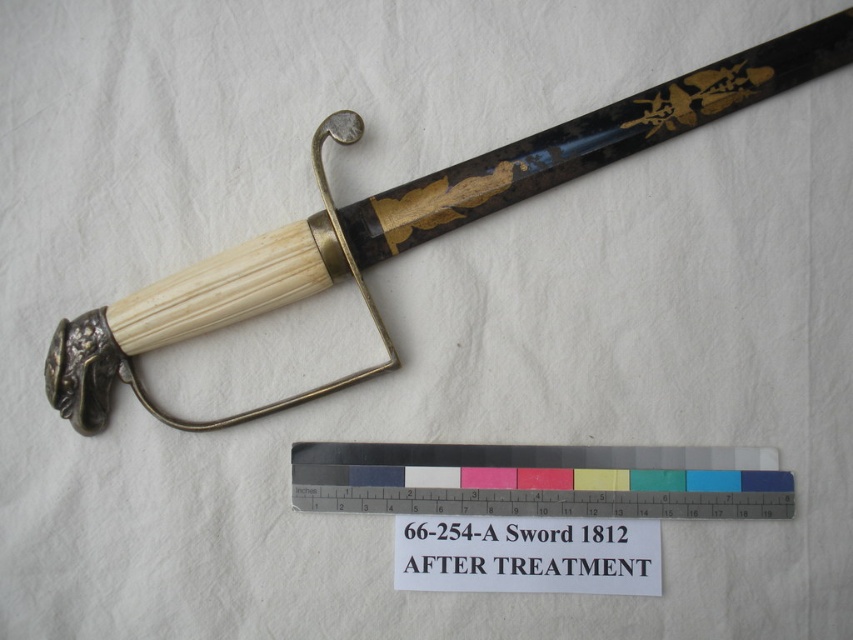
Question: Does matte black sword at upper center appear over metallic ruler at center?

Choices:
 (A) no
 (B) yes

Answer: (B)

Question: Which object appears closest to the camera in this image?

Choices:
 (A) black paper sign at lower center
 (B) matte black sword at upper center

Answer: (B)

Question: Does metallic ruler at center appear over black paper sign at lower center?

Choices:
 (A) yes
 (B) no

Answer: (A)

Question: Which object is positioned closest to the black paper sign at lower center?

Choices:
 (A) matte black sword at upper center
 (B) metallic ruler at center

Answer: (B)

Question: Among these objects, which one is nearest to the camera?

Choices:
 (A) black paper sign at lower center
 (B) matte black sword at upper center
 (C) metallic ruler at center

Answer: (B)

Question: Does metallic ruler at center have a smaller size compared to black paper sign at lower center?

Choices:
 (A) no
 (B) yes

Answer: (A)